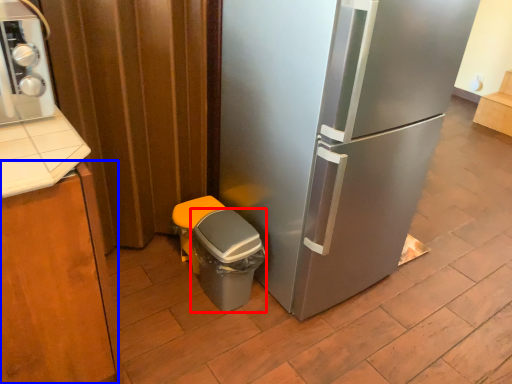
Question: Which object is closer to the camera taking this photo, potty (highlighted by a red box) or cabinetry (highlighted by a blue box)?

Choices:
 (A) potty
 (B) cabinetry

Answer: (B)